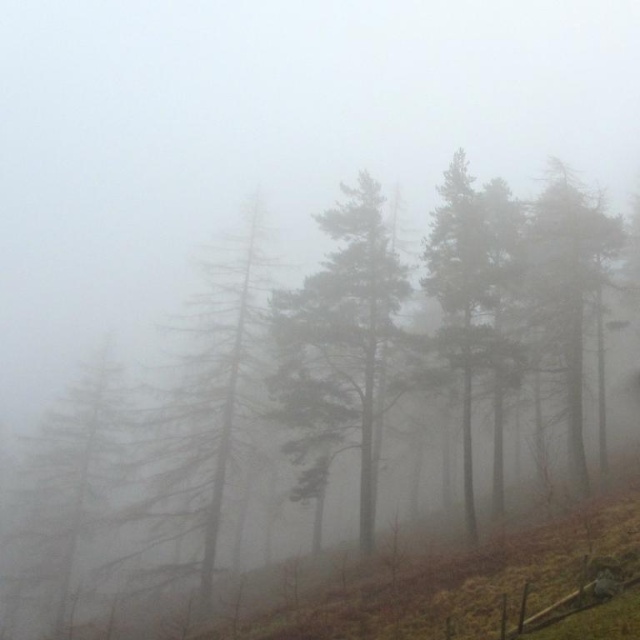
You are an environmental scientist assessing the forest structure. You observe the green textured pine tree at left and the smooth green tree at center. Which tree is shorter in height?

The green textured pine tree at left is shorter in height compared to the smooth green tree at center.

Looking at this image, you are a hiker standing in the misty forest scene. You see the green matte tree at center and the smooth green tree at center. Which tree is closer to you?

The green matte tree at center is closer to you since it is positioned further to the viewer than the smooth green tree at center.

In the misty forest scene, where is the green matte tree at center located in terms of coordinates?

The green matte tree at center is located at coordinates point (339,346).